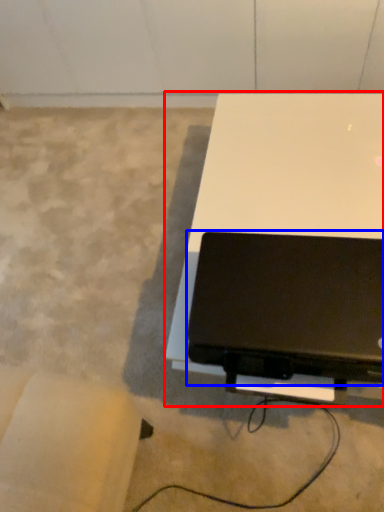
Question: Which object appears farthest to the camera in this image, table (highlighted by a red box) or laptop (highlighted by a blue box)?

Choices:
 (A) table
 (B) laptop

Answer: (A)